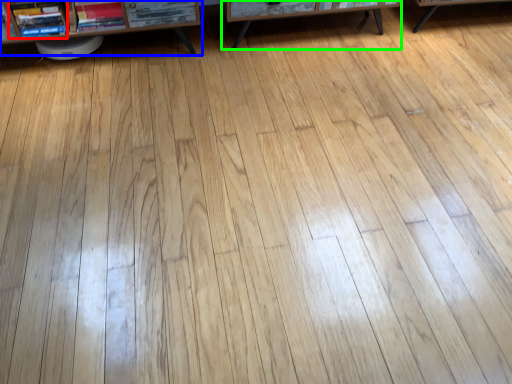
Question: Which is nearer to the book (highlighted by a red box)? shelf (highlighted by a blue box) or table (highlighted by a green box).

Choices:
 (A) shelf
 (B) table

Answer: (A)